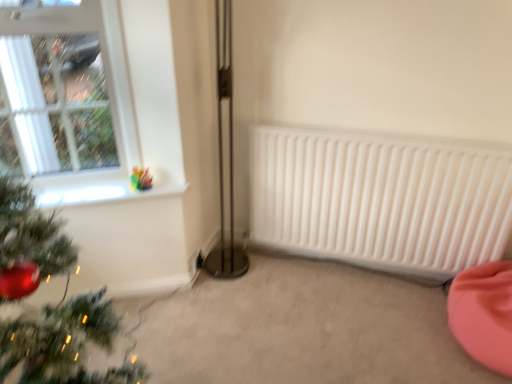
Question: Does translucent glass vase at upper left have a smaller size compared to pink fabric bean bag at lower right?

Choices:
 (A) yes
 (B) no

Answer: (A)

Question: Considering the relative sizes of translucent glass vase at upper left and pink fabric bean bag at lower right in the image provided, is translucent glass vase at upper left taller than pink fabric bean bag at lower right?

Choices:
 (A) yes
 (B) no

Answer: (B)

Question: Can you confirm if translucent glass vase at upper left is positioned to the right of pink fabric bean bag at lower right?

Choices:
 (A) yes
 (B) no

Answer: (B)

Question: From a real-world perspective, does translucent glass vase at upper left stand above pink fabric bean bag at lower right?

Choices:
 (A) yes
 (B) no

Answer: (A)

Question: Is translucent glass vase at upper left surrounding pink fabric bean bag at lower right?

Choices:
 (A) yes
 (B) no

Answer: (B)

Question: From a real-world perspective, is translucent glass vase at upper left above or below pink fabric bean bag at lower right?

Choices:
 (A) below
 (B) above

Answer: (B)

Question: Is translucent glass vase at upper left taller or shorter than pink fabric bean bag at lower right?

Choices:
 (A) short
 (B) tall

Answer: (A)

Question: Visually, is translucent glass vase at upper left positioned to the left or to the right of pink fabric bean bag at lower right?

Choices:
 (A) right
 (B) left

Answer: (B)

Question: Choose the correct answer: Is translucent glass vase at upper left inside pink fabric bean bag at lower right or outside it?

Choices:
 (A) outside
 (B) inside

Answer: (A)

Question: From the image's perspective, relative to translucent glass vase at upper left, is white glass window at upper left above or below?

Choices:
 (A) above
 (B) below

Answer: (A)

Question: Based on their sizes in the image, would you say white glass window at upper left is bigger or smaller than translucent glass vase at upper left?

Choices:
 (A) small
 (B) big

Answer: (B)

Question: Is white glass window at upper left spatially inside translucent glass vase at upper left, or outside of it?

Choices:
 (A) outside
 (B) inside

Answer: (A)

Question: Considering the positions of white glass window at upper left and translucent glass vase at upper left in the image, is white glass window at upper left wider or thinner than translucent glass vase at upper left?

Choices:
 (A) thin
 (B) wide

Answer: (A)

Question: In the image, is white glass window at upper left on the left side or the right side of pink fabric bean bag at lower right?

Choices:
 (A) right
 (B) left

Answer: (B)

Question: Does point (96, 43) appear closer or farther from the camera than point (458, 276)?

Choices:
 (A) farther
 (B) closer

Answer: (A)